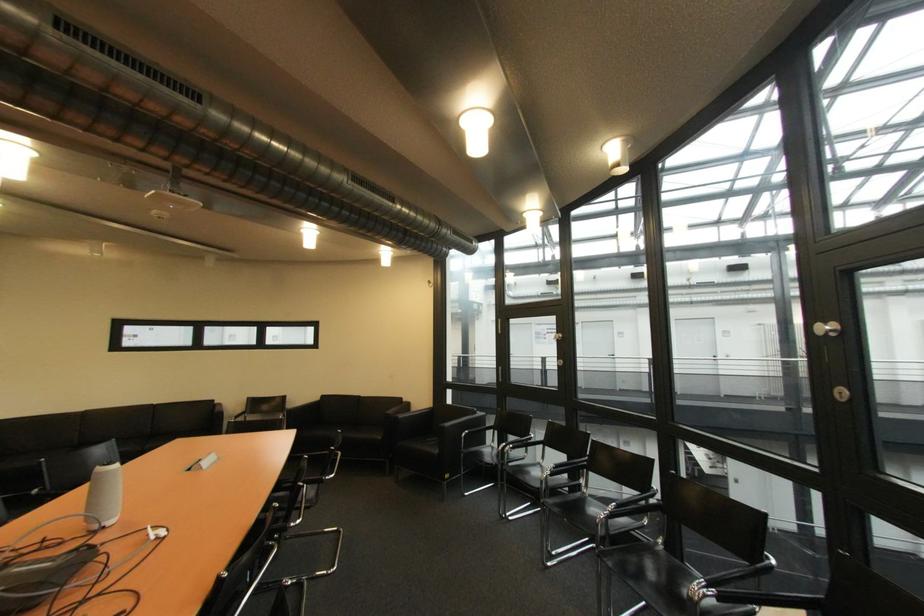
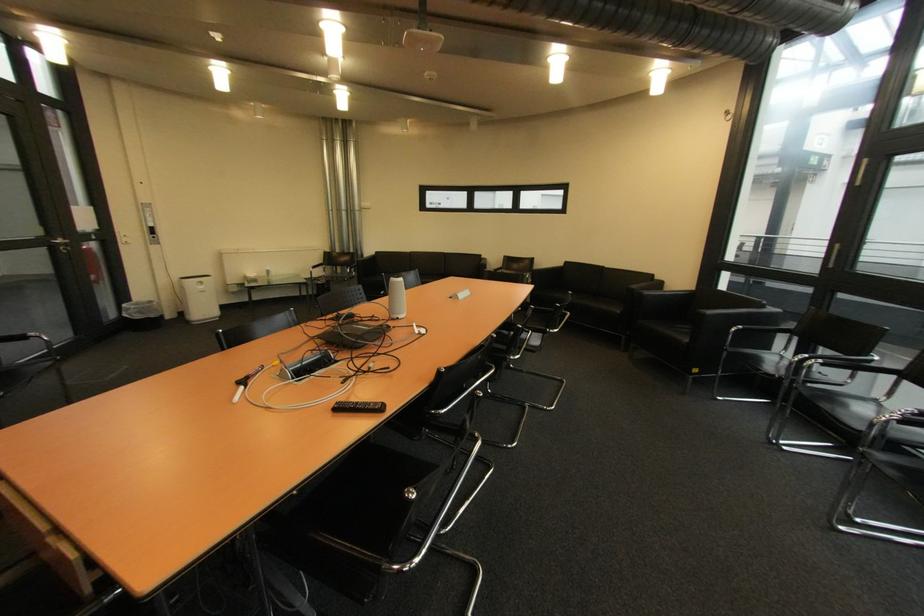
Locate, in the second image, the point that corresponds to pixel 453 429 in the first image.

(712, 315)